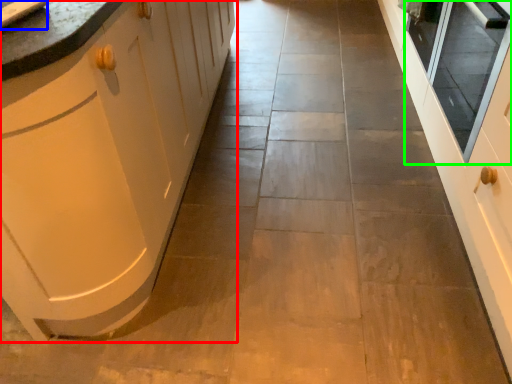
Question: Estimate the real-world distances between objects in this image. Which object is farther from cabinetry (highlighted by a red box), sink (highlighted by a blue box) or window screen (highlighted by a green box)?

Choices:
 (A) sink
 (B) window screen

Answer: (B)